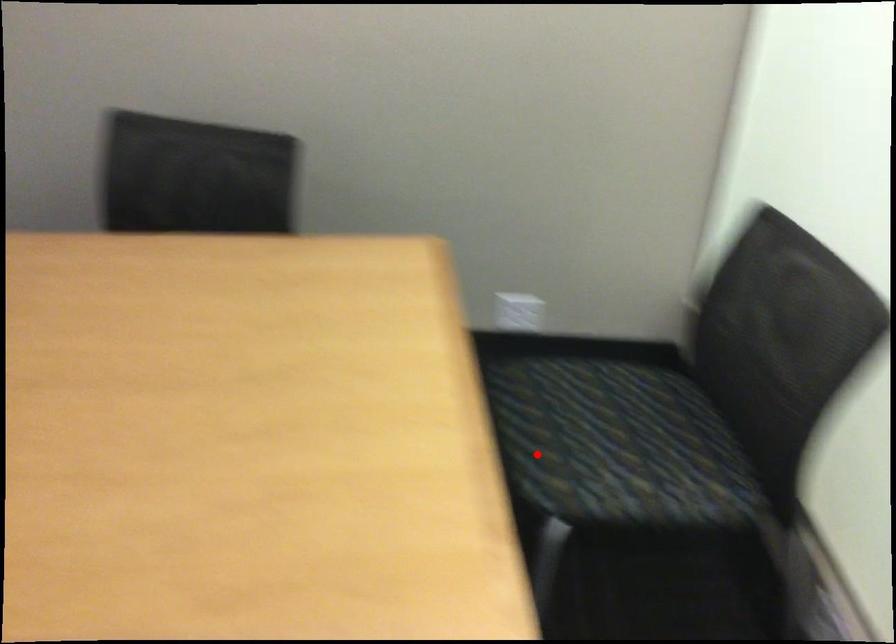
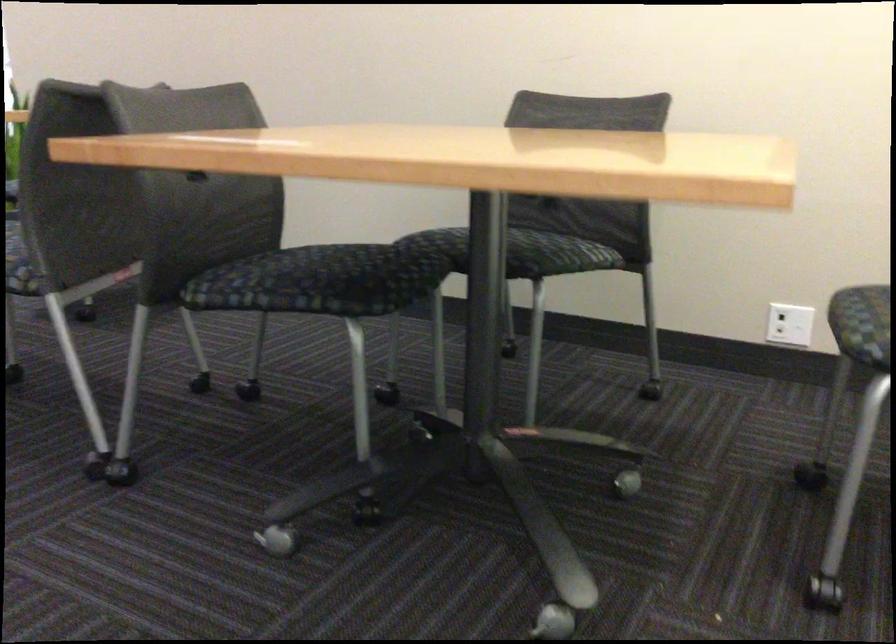
Locate, in the second image, the point that corresponds to the highlighted location in the first image.

(862, 324)